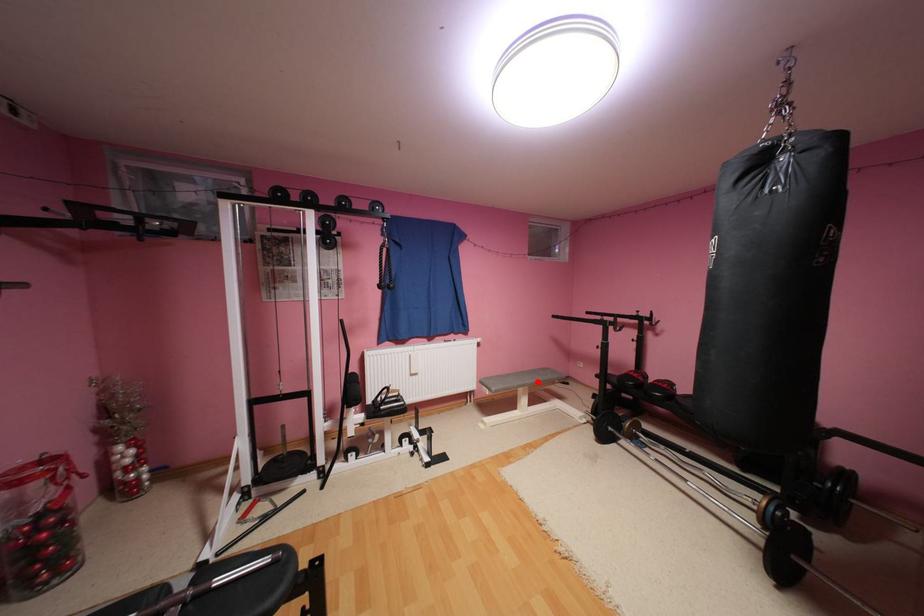
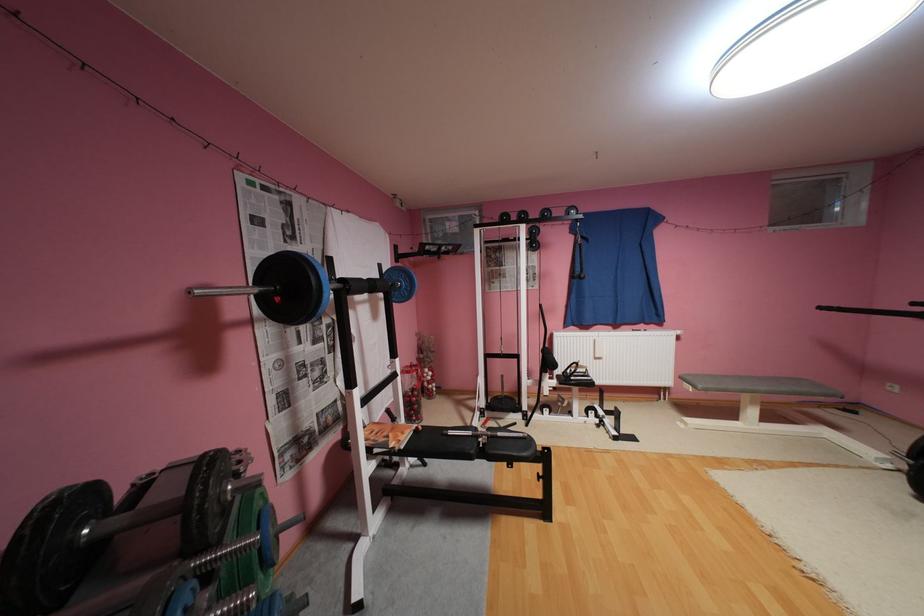
Where in the second image is the point corresponding to the highlighted location from the first image?

(771, 387)